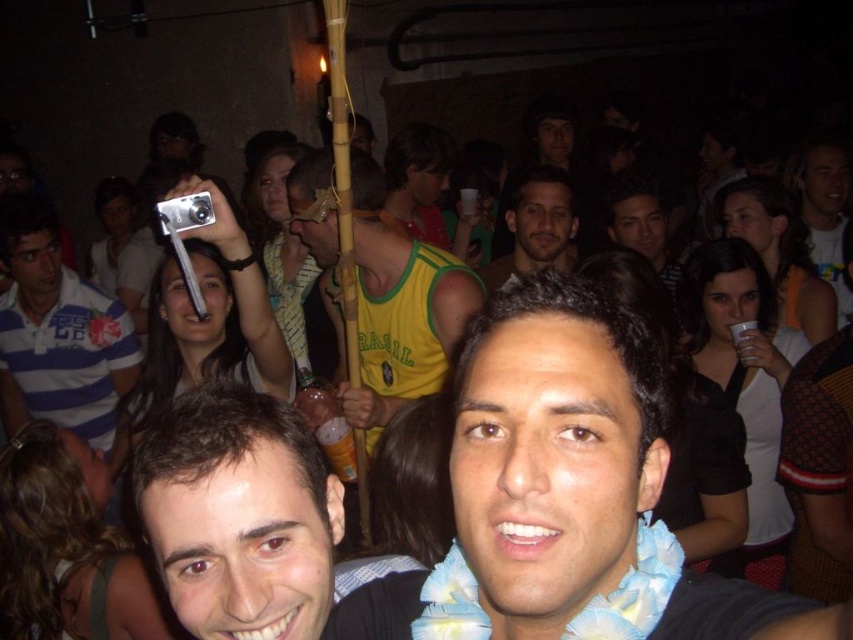
Can you confirm if smooth brown hair at center is bigger than yellow jersey at center?

Incorrect, smooth brown hair at center is not larger than yellow jersey at center.

Does smooth brown hair at center have a smaller size compared to yellow jersey at center?

Correct, smooth brown hair at center occupies less space than yellow jersey at center.

At what (x,y) coordinates should I click in order to perform the action: click on smooth brown hair at center. Please return your answer as a coordinate pair (x, y). The image size is (853, 640). Looking at the image, I should click on (239, 515).

Where is `smooth brown hair at center`? The width and height of the screenshot is (853, 640). smooth brown hair at center is located at coordinates (239, 515).

Is blue floral shirt at center behind matte brown hair at center?

That is False.

The image size is (853, 640). Find the location of `blue floral shirt at center`. blue floral shirt at center is located at coordinates (566, 496).

I want to click on blue floral shirt at center, so pos(566,496).

Can you confirm if blue striped polo shirt at left is positioned below matte brown hair at center?

Indeed, blue striped polo shirt at left is positioned under matte brown hair at center.

Looking at this image, can you confirm if blue striped polo shirt at left is positioned above matte brown hair at center?

No, blue striped polo shirt at left is not above matte brown hair at center.

Does point (91, 428) come closer to viewer compared to point (558, 225)?

No.

Locate an element on the screen. blue striped polo shirt at left is located at coordinates (57, 333).